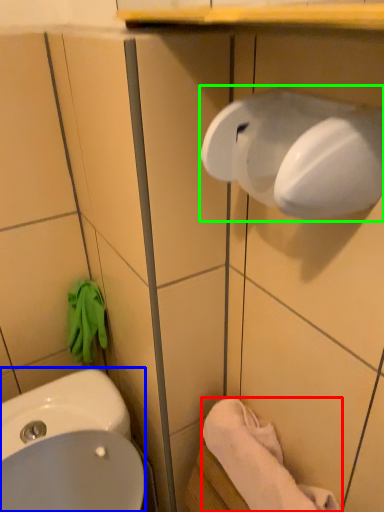
Question: Which object is positioned farthest from towel/napkin (highlighted by a red box)? Select from sink (highlighted by a blue box) and hand dryer (highlighted by a green box).

Choices:
 (A) sink
 (B) hand dryer

Answer: (B)